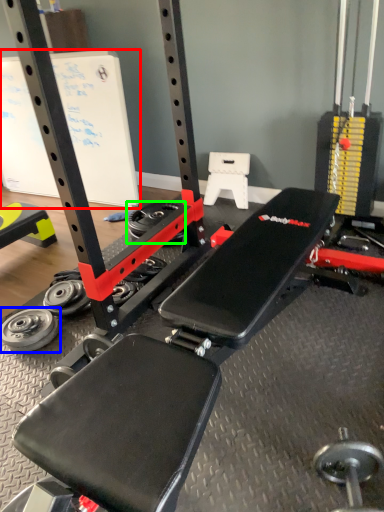
Question: Which object is the closest to the bulletin board (highlighted by a red box)? Choose among these: wheel (highlighted by a blue box) or wheel (highlighted by a green box).

Choices:
 (A) wheel
 (B) wheel

Answer: (B)